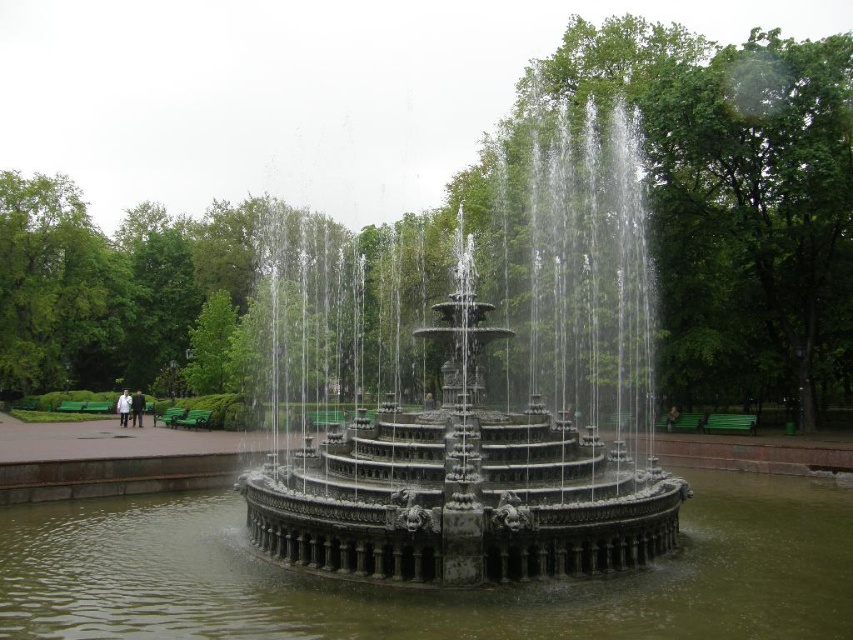
Is point (480, 452) closer to viewer compared to point (685, 605)?

No, (480, 452) is further to viewer.

Based on the photo, who is positioned more to the left, polished stone fountain at center or greenish water at center?

Positioned to the left is polished stone fountain at center.

Is point (486, 428) positioned before point (726, 604)?

That is False.

The image size is (853, 640). Identify the location of polished stone fountain at center. (503, 417).